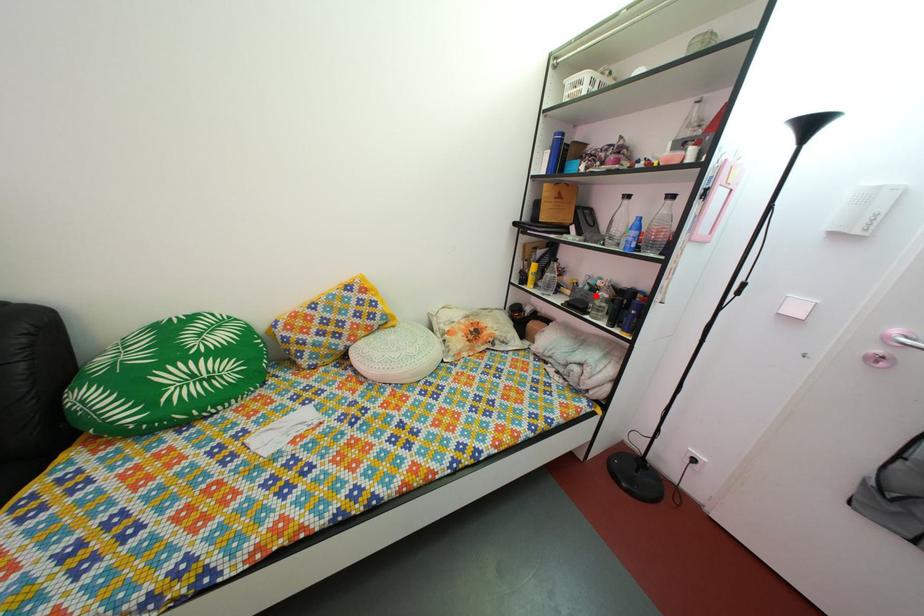
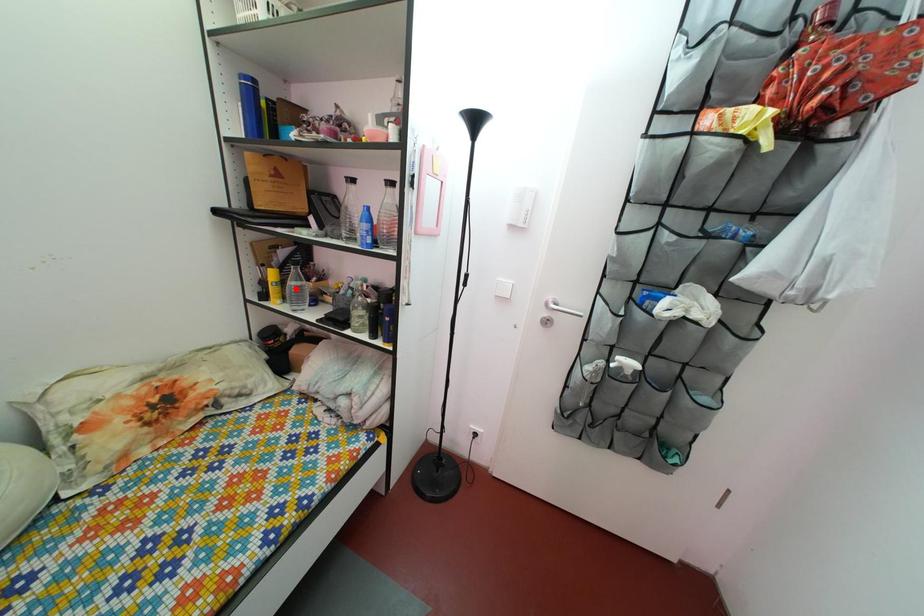
I am providing you with two images of the same scene from different viewpoints. A red point is marked on the first image and another point is marked on the second image. Does the point marked in image1 correspond to the same location as the one in image2?

No